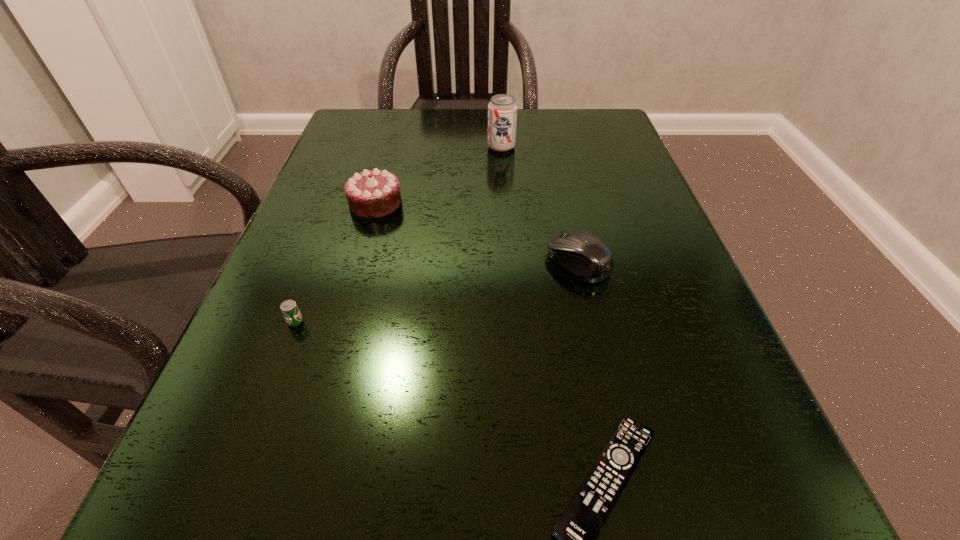
The width and height of the screenshot is (960, 540). Identify the location of free space that satisfies the following two spatial constraints: 1. on the back side of the fourth tallest object; 2. on the left side of the third farthest object. (318, 262).

I want to click on vacant region that satisfies the following two spatial constraints: 1. on the back side of the second farthest object; 2. on the right side of the farther beer can, so click(x=392, y=147).